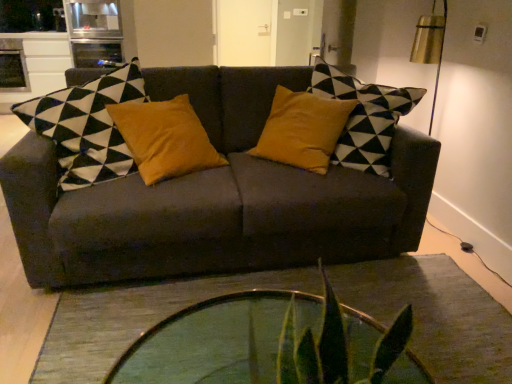
Locate an element on the screen. dark gray fabric couch at center is located at coordinates (215, 198).

This screenshot has height=384, width=512. What do you see at coordinates (215, 198) in the screenshot? I see `dark gray fabric couch at center` at bounding box center [215, 198].

Where is `transparent glass coffee table at center`? This screenshot has height=384, width=512. transparent glass coffee table at center is located at coordinates (221, 340).

Measure the distance between transparent glass coffee table at center and camera.

transparent glass coffee table at center and camera are 1.24 meters apart.

Image resolution: width=512 pixels, height=384 pixels. What do you see at coordinates (221, 340) in the screenshot?
I see `transparent glass coffee table at center` at bounding box center [221, 340].

What is the approximate height of transparent glass coffee table at center?

It is 15.70 inches.

Locate an element on the screen. dark gray fabric couch at center is located at coordinates (215, 198).

Which is more to the right, transparent glass coffee table at center or dark gray fabric couch at center?

Positioned to the right is transparent glass coffee table at center.

Considering the relative positions of transparent glass coffee table at center and dark gray fabric couch at center in the image provided, is transparent glass coffee table at center behind dark gray fabric couch at center?

No, it is in front of dark gray fabric couch at center.

Does point (407, 357) come closer to viewer compared to point (431, 156)?

That is True.

From the image's perspective, which one is positioned higher, transparent glass coffee table at center or dark gray fabric couch at center?

dark gray fabric couch at center appears higher in the image.

From the picture: From a real-world perspective, does transparent glass coffee table at center sit lower than dark gray fabric couch at center?

Correct, in the physical world, transparent glass coffee table at center is lower than dark gray fabric couch at center.

Looking at this image, which object is thinner, transparent glass coffee table at center or dark gray fabric couch at center?

Thinner between the two is transparent glass coffee table at center.

In the scene shown: Is transparent glass coffee table at center taller or shorter than dark gray fabric couch at center?

transparent glass coffee table at center is shorter than dark gray fabric couch at center.

Between transparent glass coffee table at center and dark gray fabric couch at center, which one has smaller size?

With smaller size is transparent glass coffee table at center.

Is transparent glass coffee table at center spatially inside dark gray fabric couch at center, or outside of it?

transparent glass coffee table at center cannot be found inside dark gray fabric couch at center.

Is transparent glass coffee table at center far away from dark gray fabric couch at center?

No.

In the scene shown: Is transparent glass coffee table at center facing towards dark gray fabric couch at center?

Answer: No, transparent glass coffee table at center is not turned towards dark gray fabric couch at center.

How many degrees apart are the facing directions of transparent glass coffee table at center and dark gray fabric couch at center?

transparent glass coffee table at center and dark gray fabric couch at center are facing 91.4 degrees away from each other.

This screenshot has width=512, height=384. I want to click on studio couch above the transparent glass coffee table at center (from a real-world perspective), so click(215, 198).

Considering the positions of objects dark gray fabric couch at center and transparent glass coffee table at center in the image provided, who is more to the left, dark gray fabric couch at center or transparent glass coffee table at center?

dark gray fabric couch at center is more to the left.

Is dark gray fabric couch at center closer to camera compared to transparent glass coffee table at center?

No, it is not.

Is point (83, 235) less distant than point (350, 329)?

No.

From the image's perspective, is dark gray fabric couch at center beneath transparent glass coffee table at center?

No, from the image's perspective, dark gray fabric couch at center is not beneath transparent glass coffee table at center.

From a real-world perspective, is dark gray fabric couch at center beneath transparent glass coffee table at center?

No.

Which object is wider, dark gray fabric couch at center or transparent glass coffee table at center?

With larger width is dark gray fabric couch at center.

Can you confirm if dark gray fabric couch at center is taller than transparent glass coffee table at center?

Indeed, dark gray fabric couch at center has a greater height compared to transparent glass coffee table at center.

In the scene shown: Between dark gray fabric couch at center and transparent glass coffee table at center, which one has smaller size?

Smaller between the two is transparent glass coffee table at center.

Is transparent glass coffee table at center a part of dark gray fabric couch at center?

No, transparent glass coffee table at center is located outside of dark gray fabric couch at center.

Is the surface of dark gray fabric couch at center in direct contact with transparent glass coffee table at center?

No, dark gray fabric couch at center is not making contact with transparent glass coffee table at center.

Does dark gray fabric couch at center turn towards transparent glass coffee table at center?

Yes.

How many degrees apart are the facing directions of dark gray fabric couch at center and transparent glass coffee table at center?

There is a 91.4-degree angle between the facing directions of dark gray fabric couch at center and transparent glass coffee table at center.

At what (x,y) coordinates should I click in order to perform the action: click on studio couch lying behind the transparent glass coffee table at center. Please return your answer as a coordinate pair (x, y). The height and width of the screenshot is (384, 512). Looking at the image, I should click on (x=215, y=198).

At what (x,y) coordinates should I click in order to perform the action: click on studio couch located above the transparent glass coffee table at center (from a real-world perspective). Please return your answer as a coordinate pair (x, y). The width and height of the screenshot is (512, 384). Looking at the image, I should click on (215, 198).

Locate an element on the screen. coffee table below the dark gray fabric couch at center (from the image's perspective) is located at coordinates (221, 340).